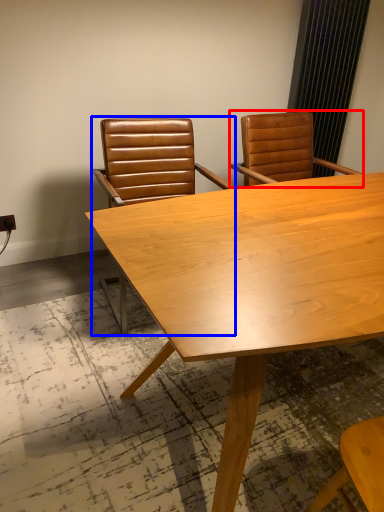
Question: Which object is closer to the camera taking this photo, chair (highlighted by a red box) or chair (highlighted by a blue box)?

Choices:
 (A) chair
 (B) chair

Answer: (B)